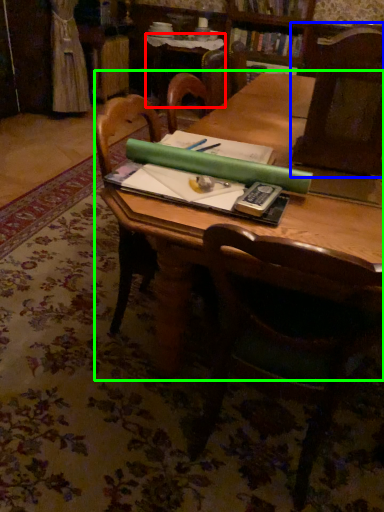
Question: Which object is positioned closest to side table (highlighted by a red box)? Select from chair (highlighted by a blue box) and table (highlighted by a green box).

Choices:
 (A) chair
 (B) table

Answer: (B)